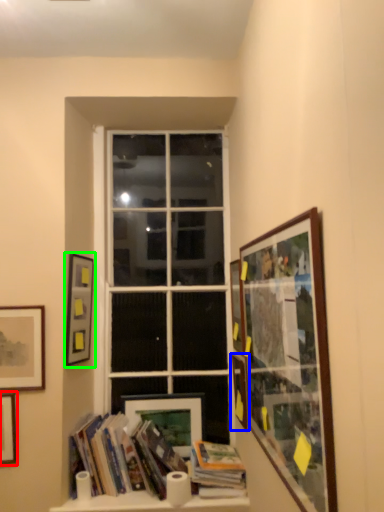
Question: Estimate the real-world distances between objects in this image. Which object is farther from picture frame (highlighted by a red box), picture frame (highlighted by a blue box) or picture frame (highlighted by a green box)?

Choices:
 (A) picture frame
 (B) picture frame

Answer: (A)